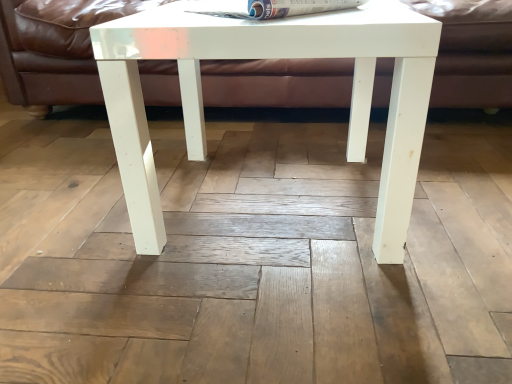
Question: From a real-world perspective, is white glossy table at center positioned over matte brown leather couch at upper center based on gravity?

Choices:
 (A) no
 (B) yes

Answer: (A)

Question: Does white glossy table at center have a lesser height compared to matte brown leather couch at upper center?

Choices:
 (A) yes
 (B) no

Answer: (A)

Question: Is white glossy table at center directly adjacent to matte brown leather couch at upper center?

Choices:
 (A) no
 (B) yes

Answer: (A)

Question: Does white glossy table at center have a lesser width compared to matte brown leather couch at upper center?

Choices:
 (A) no
 (B) yes

Answer: (B)

Question: Would you say matte brown leather couch at upper center is part of white glossy table at center's contents?

Choices:
 (A) no
 (B) yes

Answer: (A)

Question: From a real-world perspective, is white glossy table at center under matte brown leather couch at upper center?

Choices:
 (A) yes
 (B) no

Answer: (A)

Question: Could white glossy table at center be considered to be inside matte brown leather couch at upper center?

Choices:
 (A) no
 (B) yes

Answer: (A)

Question: Considering the relative sizes of matte brown leather couch at upper center and white glossy table at center in the image provided, is matte brown leather couch at upper center taller than white glossy table at center?

Choices:
 (A) yes
 (B) no

Answer: (A)

Question: From a real-world perspective, does matte brown leather couch at upper center sit lower than white glossy table at center?

Choices:
 (A) yes
 (B) no

Answer: (B)

Question: Is matte brown leather couch at upper center closer to camera compared to white glossy table at center?

Choices:
 (A) no
 (B) yes

Answer: (A)

Question: Is matte brown leather couch at upper center positioned beyond the bounds of white glossy table at center?

Choices:
 (A) no
 (B) yes

Answer: (B)

Question: Considering the relative positions of matte brown leather couch at upper center and white glossy table at center in the image provided, is matte brown leather couch at upper center to the left of white glossy table at center from the viewer's perspective?

Choices:
 (A) no
 (B) yes

Answer: (A)

Question: Are white glossy magazine at upper center and white glossy table at center far apart?

Choices:
 (A) no
 (B) yes

Answer: (A)